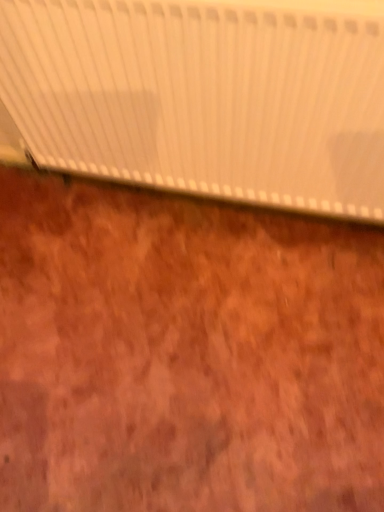
Question: Does brown wood plywood at center have a lesser width compared to white matte radiator at upper center?

Choices:
 (A) no
 (B) yes

Answer: (A)

Question: Is brown wood plywood at center positioned behind white matte radiator at upper center?

Choices:
 (A) yes
 (B) no

Answer: (A)

Question: Is brown wood plywood at center bigger than white matte radiator at upper center?

Choices:
 (A) no
 (B) yes

Answer: (A)

Question: Is brown wood plywood at center at the left side of white matte radiator at upper center?

Choices:
 (A) yes
 (B) no

Answer: (A)

Question: From a real-world perspective, is brown wood plywood at center positioned under white matte radiator at upper center based on gravity?

Choices:
 (A) yes
 (B) no

Answer: (A)

Question: Can you confirm if brown wood plywood at center is wider than white matte radiator at upper center?

Choices:
 (A) yes
 (B) no

Answer: (A)

Question: Can brown wood plywood at center be found inside white matte radiator at upper center?

Choices:
 (A) no
 (B) yes

Answer: (A)

Question: Is white matte radiator at upper center further to camera compared to brown wood plywood at center?

Choices:
 (A) no
 (B) yes

Answer: (A)

Question: Is white matte radiator at upper center positioned far away from brown wood plywood at center?

Choices:
 (A) yes
 (B) no

Answer: (B)

Question: From a real-world perspective, is white matte radiator at upper center on top of brown wood plywood at center?

Choices:
 (A) yes
 (B) no

Answer: (A)

Question: Can you confirm if white matte radiator at upper center is positioned to the left of brown wood plywood at center?

Choices:
 (A) yes
 (B) no

Answer: (B)

Question: From a real-world perspective, is white matte radiator at upper center beneath brown wood plywood at center?

Choices:
 (A) yes
 (B) no

Answer: (B)

Question: Considering the relative positions of white matte radiator at upper center and brown wood plywood at center in the image provided, is white matte radiator at upper center to the left or to the right of brown wood plywood at center?

Choices:
 (A) right
 (B) left

Answer: (A)